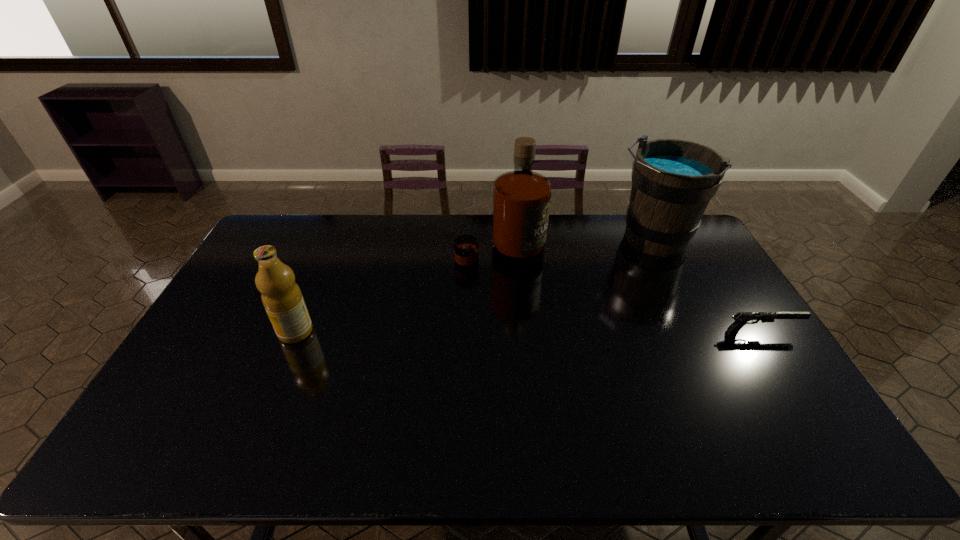
Where is `free space on the desktop that is between the second shortest object and the gun and is positioned on the front label of the liquor`? This screenshot has width=960, height=540. free space on the desktop that is between the second shortest object and the gun and is positioned on the front label of the liquor is located at coordinates (562, 332).

Identify the location of vacant space on the desktop that is between the second shortest object and the shortest object and is positioned with a handle on the side of the wine bucket. (572, 332).